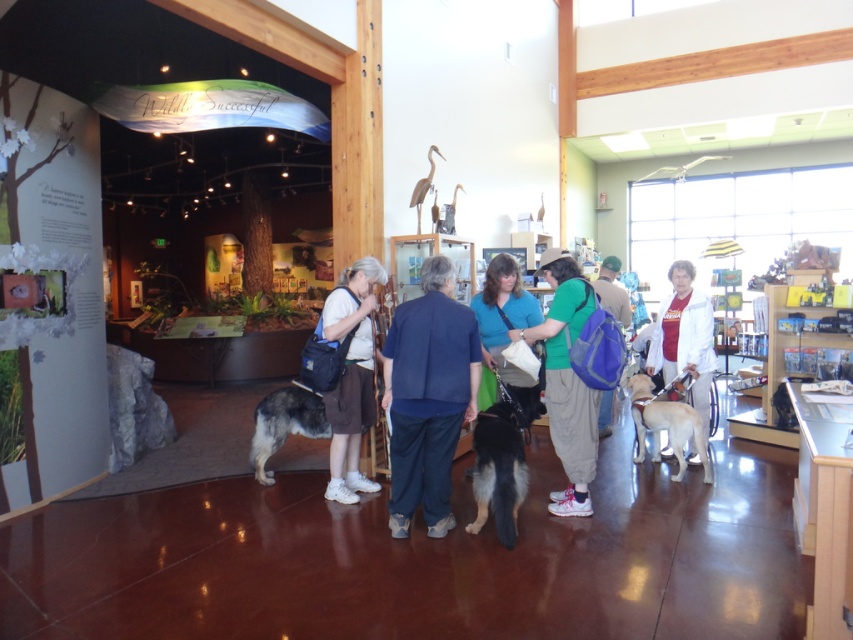
Is gray woolen dog at center to the right of blue fabric backpack at center from the viewer's perspective?

No, gray woolen dog at center is not to the right of blue fabric backpack at center.

Does gray woolen dog at center have a lesser height compared to blue fabric backpack at center?

No.

Does point (292, 410) lie behind point (614, 266)?

No, (292, 410) is closer to viewer.

Locate an element on the screen. This screenshot has width=853, height=640. gray woolen dog at center is located at coordinates pyautogui.click(x=283, y=424).

Which is more to the left, blue fabric jacket at center or white matte jacket at center?

blue fabric jacket at center is more to the left.

Who is more distant from viewer, (413, 317) or (699, 348)?

The point (699, 348) is more distant.

What are the coordinates of `blue fabric jacket at center` in the screenshot? It's located at (428, 396).

Can you confirm if matte black backpack at left is positioned to the right of blue fabric shirt at center?

Incorrect, matte black backpack at left is not on the right side of blue fabric shirt at center.

Who is positioned more to the left, matte black backpack at left or blue fabric shirt at center?

matte black backpack at left

Is point (343, 417) closer to viewer compared to point (525, 385)?

Yes, point (343, 417) is closer to viewer.

Where is `matte black backpack at left`? matte black backpack at left is located at coordinates (351, 376).